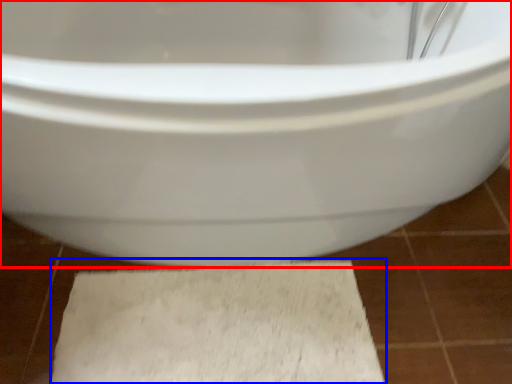
Question: Which object appears closest to the camera in this image, toilet (highlighted by a red box) or bath mat (highlighted by a blue box)?

Choices:
 (A) toilet
 (B) bath mat

Answer: (A)